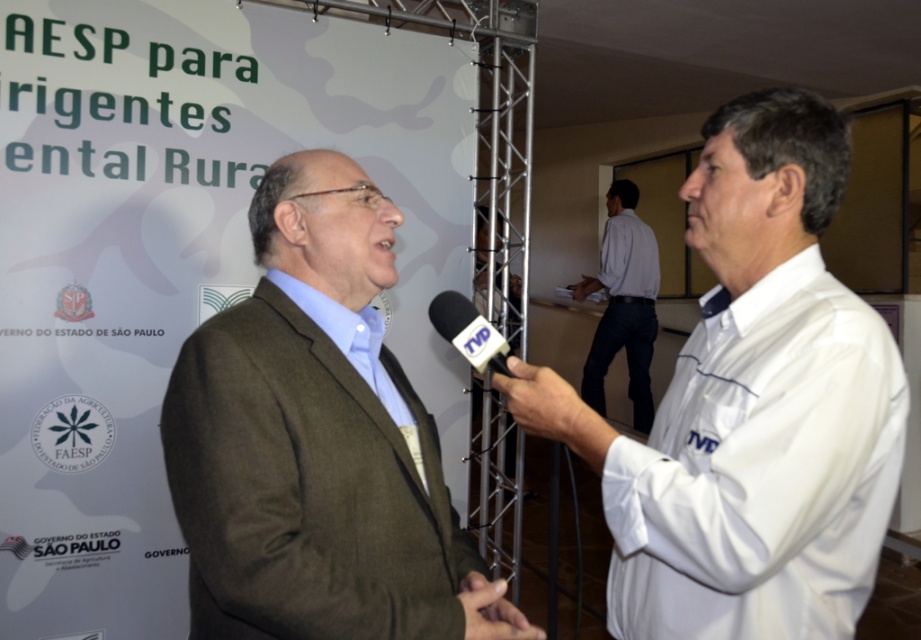
Looking at this image, in the image of the formal interview setting, where exactly is the matte brown suit at center located in terms of coordinates?

The matte brown suit at center is located at point (317,442).

You are a photographer at the event and need to capture a clear photo of both the white glossy shirt at center and the matte brown suit at center. Since the camera can only focus on one subject at a time, which one should you focus on to ensure the other is still in the frame?

The white glossy shirt at center is positioned on the right side of the matte brown suit at center, so focusing on the matte brown suit at center would keep the white glossy shirt at center within the frame as it is to the right.